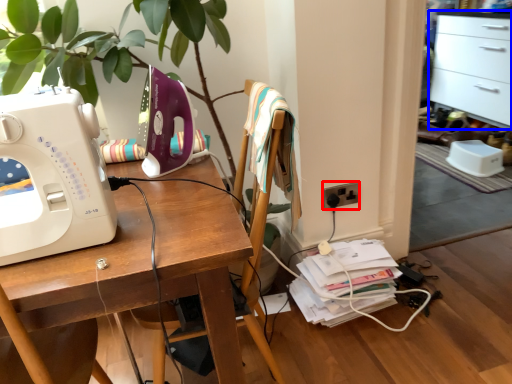
Question: Which point is closer to the camera, electric outlet (highlighted by a red box) or file cabinet (highlighted by a blue box)?

Choices:
 (A) electric outlet
 (B) file cabinet

Answer: (A)